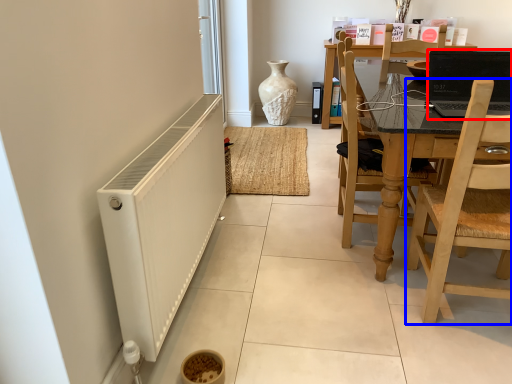
Question: Among these objects, which one is nearest to the camera, laptop (highlighted by a red box) or chair (highlighted by a blue box)?

Choices:
 (A) laptop
 (B) chair

Answer: (B)